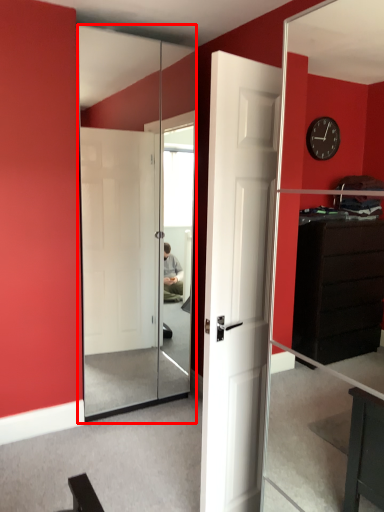
Question: Observing the image, what is the correct spatial positioning of screen door (annotated by the red box) in reference to door?

Choices:
 (A) right
 (B) left

Answer: (B)